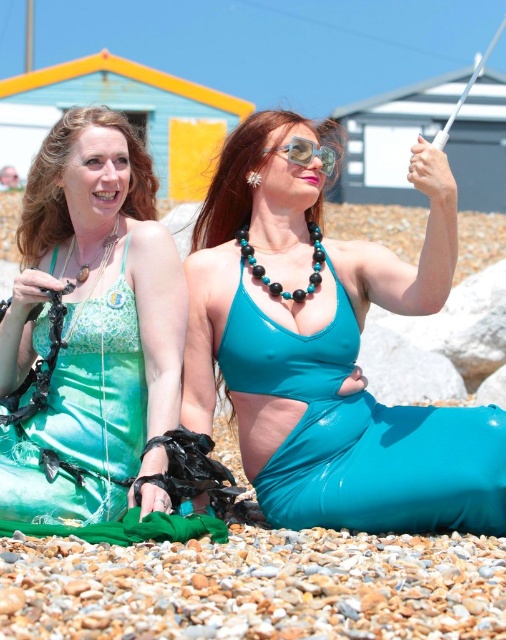
You are a photographer trying to capture a photo of both points in the image. The points are located at coordinates point (x=430, y=205) and point (x=151, y=432). Based on their positions, which point is closer to the camera?

Point (x=430, y=205) is further to the camera than point (x=151, y=432). Therefore, point (x=151, y=432) is closer to the camera.